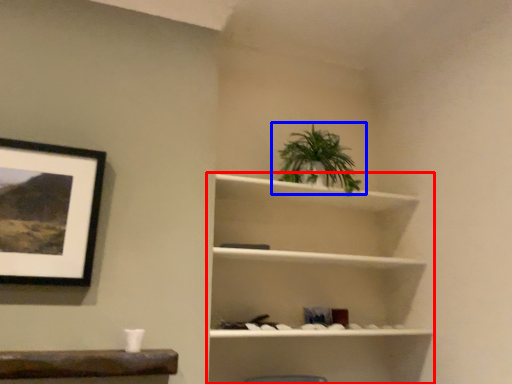
Question: Which object is further to the camera taking this photo, shelf (highlighted by a red box) or houseplant (highlighted by a blue box)?

Choices:
 (A) shelf
 (B) houseplant

Answer: (B)